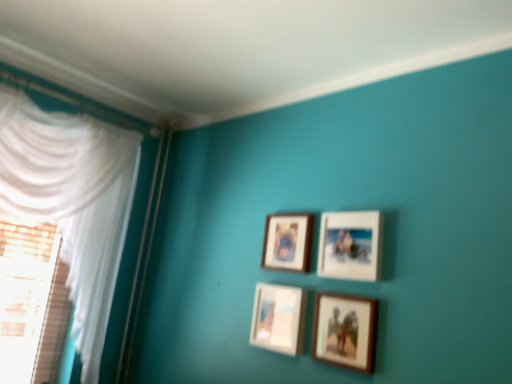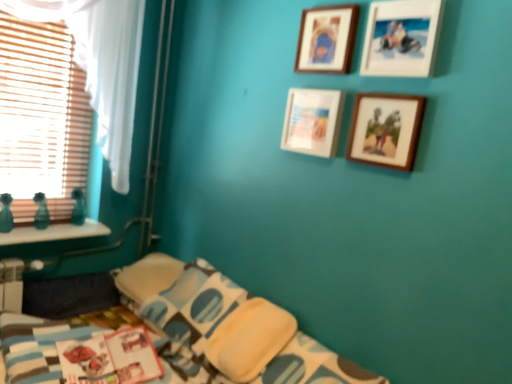
Question: How did the camera likely rotate when shooting the video?

Choices:
 (A) rotated downward
 (B) rotated upward

Answer: (A)